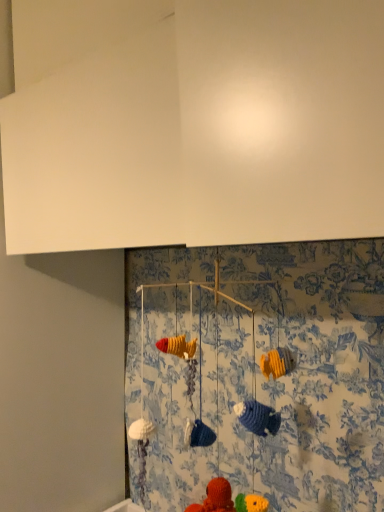
From the picture: Measure the distance between point (93, 145) and camera.

The depth of point (93, 145) is 83.70 centimeters.

What is the approximate height of white matte cabinet at upper center?

white matte cabinet at upper center is 32.24 inches tall.

Image resolution: width=384 pixels, height=512 pixels. What are the coordinates of `white matte cabinet at upper center` in the screenshot? It's located at (205, 132).

Describe the element at coordinates (205, 132) in the screenshot. Image resolution: width=384 pixels, height=512 pixels. I see `white matte cabinet at upper center` at that location.

This screenshot has height=512, width=384. Find the location of `white matte cabinet at upper center`. white matte cabinet at upper center is located at coordinates (205, 132).